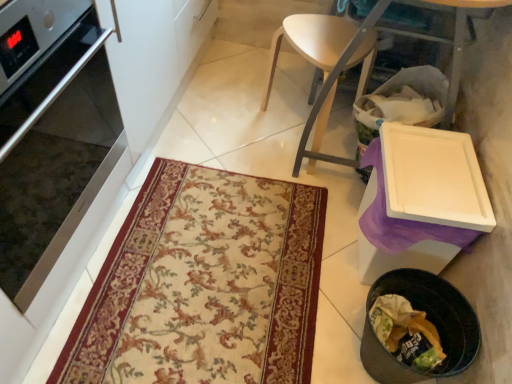
This screenshot has width=512, height=384. I want to click on satin silver oven at left, so click(54, 152).

Describe the element at coordinates (330, 88) in the screenshot. The width and height of the screenshot is (512, 384). I see `white plastic cutting board at right` at that location.

You are a GUI agent. You are given a task and a screenshot of the screen. Output one action in this format:
    pyautogui.click(x=<x>, y=<y>)
    Task: Click on the satin silver oven at left
    
    Given the screenshot: What is the action you would take?
    pyautogui.click(x=54, y=152)

From the picture: From a real-world perspective, is black plastic trash can at lower right physically below satin silver oven at left?

Yes, from a real-world perspective, black plastic trash can at lower right is beneath satin silver oven at left.

Considering the relative sizes of black plastic trash can at lower right and satin silver oven at left in the image provided, is black plastic trash can at lower right thinner than satin silver oven at left?

Yes.

Considering the sizes of objects black plastic trash can at lower right and satin silver oven at left in the image provided, who is taller, black plastic trash can at lower right or satin silver oven at left?

With more height is satin silver oven at left.

In the scene shown: Is black plastic trash can at lower right to the left or to the right of satin silver oven at left in the image?

black plastic trash can at lower right is to the right of satin silver oven at left.

How far apart are black plastic trash can at lower right and beige floral rug at center?

A distance of 18.05 inches exists between black plastic trash can at lower right and beige floral rug at center.

From a real-world perspective, is black plastic trash can at lower right physically below beige floral rug at center?

No, from a real-world perspective, black plastic trash can at lower right is not beneath beige floral rug at center.

Between black plastic trash can at lower right and beige floral rug at center, which one has larger width?

beige floral rug at center.

Looking at this image, is black plastic trash can at lower right positioned with its back to beige floral rug at center?

No, black plastic trash can at lower right's orientation is not away from beige floral rug at center.

Considering the sizes of objects satin silver oven at left and white plastic cutting board at right in the image provided, who is shorter, satin silver oven at left or white plastic cutting board at right?

satin silver oven at left is shorter.

Is satin silver oven at left with white plastic cutting board at right?

No, satin silver oven at left is not with white plastic cutting board at right.

The height and width of the screenshot is (384, 512). Identify the location of table behind the satin silver oven at left. (330, 88).

Looking at this image, considering the positions of objects satin silver oven at left and white plastic cutting board at right in the image provided, who is behind, satin silver oven at left or white plastic cutting board at right?

white plastic cutting board at right is further away from the camera.

Can you confirm if white plastic cutting board at right is taller than satin silver oven at left?

Correct, white plastic cutting board at right is much taller as satin silver oven at left.

Between white plastic cutting board at right and satin silver oven at left, which one is positioned behind?

white plastic cutting board at right is behind.

Which of these two, white plastic cutting board at right or satin silver oven at left, is thinner?

Thinner between the two is white plastic cutting board at right.

Can we say light wood chair at center lies outside black plastic trash can at lower right?

Absolutely, light wood chair at center is external to black plastic trash can at lower right.

Does light wood chair at center touch black plastic trash can at lower right?

light wood chair at center is not next to black plastic trash can at lower right, and they're not touching.

In the scene shown: From a real-world perspective, between light wood chair at center and black plastic trash can at lower right, who is vertically higher?

light wood chair at center is physically above.

Does light wood chair at center have a larger size compared to black plastic trash can at lower right?

Yes, light wood chair at center is bigger than black plastic trash can at lower right.

Between white plastic cutting board at right and light wood chair at center, which one has less height?

light wood chair at center.

Is white plastic cutting board at right with light wood chair at center?

No, white plastic cutting board at right is not next to light wood chair at center.

From a real-world perspective, who is located lower, white plastic cutting board at right or light wood chair at center?

light wood chair at center is physically lower.

Is satin silver oven at left thinner than light wood chair at center?

No, satin silver oven at left is not thinner than light wood chair at center.

Which of these two, satin silver oven at left or light wood chair at center, stands shorter?

Standing shorter between the two is light wood chair at center.

Is satin silver oven at left beside light wood chair at center?

No, satin silver oven at left is not with light wood chair at center.

Do you think satin silver oven at left is within light wood chair at center, or outside of it?

satin silver oven at left exists outside the volume of light wood chair at center.

You are a GUI agent. You are given a task and a screenshot of the screen. Output one action in this format:
    pyautogui.click(x=<x>, y=<y>)
    Task: Click on the oven above the black plastic trash can at lower right (from the image's perspective)
    The width and height of the screenshot is (512, 384).
    Given the screenshot: What is the action you would take?
    pyautogui.click(x=54, y=152)

You are a GUI agent. You are given a task and a screenshot of the screen. Output one action in this format:
    pyautogui.click(x=<x>, y=<y>)
    Task: Click on the mat on the left of black plastic trash can at lower right
    The width and height of the screenshot is (512, 384).
    Given the screenshot: What is the action you would take?
    pyautogui.click(x=204, y=284)

Estimate the real-world distances between objects in this image. Which object is further from beige floral rug at center, white plastic cutting board at right or black plastic trash can at lower right?

white plastic cutting board at right.

Looking at the image, which one is located further to white plastic cutting board at right, beige floral rug at center or satin silver oven at left?

satin silver oven at left is further to white plastic cutting board at right.

From the image, which object appears to be farther from beige floral rug at center, satin silver oven at left or black plastic trash can at lower right?

Among the two, satin silver oven at left is located further to beige floral rug at center.

Consider the image. Based on their spatial positions, is white plastic cutting board at right or beige floral rug at center closer to black plastic trash can at lower right?

beige floral rug at center is closer to black plastic trash can at lower right.

Estimate the real-world distances between objects in this image. Which object is further from satin silver oven at left, beige floral rug at center or light wood chair at center?

light wood chair at center.

From the image, which object appears to be nearer to light wood chair at center, beige floral rug at center or black plastic trash can at lower right?

The object closer to light wood chair at center is beige floral rug at center.

Based on their spatial positions, is white plastic cutting board at right or beige floral rug at center closer to satin silver oven at left?

The object closer to satin silver oven at left is beige floral rug at center.

Estimate the real-world distances between objects in this image. Which object is closer to black plastic trash can at lower right, satin silver oven at left or light wood chair at center?

light wood chair at center lies closer to black plastic trash can at lower right than the other object.

Where is `mat between light wood chair at center and black plastic trash can at lower right vertically`? The image size is (512, 384). mat between light wood chair at center and black plastic trash can at lower right vertically is located at coordinates (204, 284).

I want to click on chair between white plastic cutting board at right and beige floral rug at center in the vertical direction, so click(x=326, y=67).

At what (x,y) coordinates should I click in order to perform the action: click on chair between white plastic cutting board at right and black plastic trash can at lower right from top to bottom. Please return your answer as a coordinate pair (x, y). The height and width of the screenshot is (384, 512). Looking at the image, I should click on (326, 67).

You are a GUI agent. You are given a task and a screenshot of the screen. Output one action in this format:
    pyautogui.click(x=<x>, y=<y>)
    Task: Click on the mat situated between satin silver oven at left and white plastic cutting board at right from left to right
    
    Given the screenshot: What is the action you would take?
    pyautogui.click(x=204, y=284)